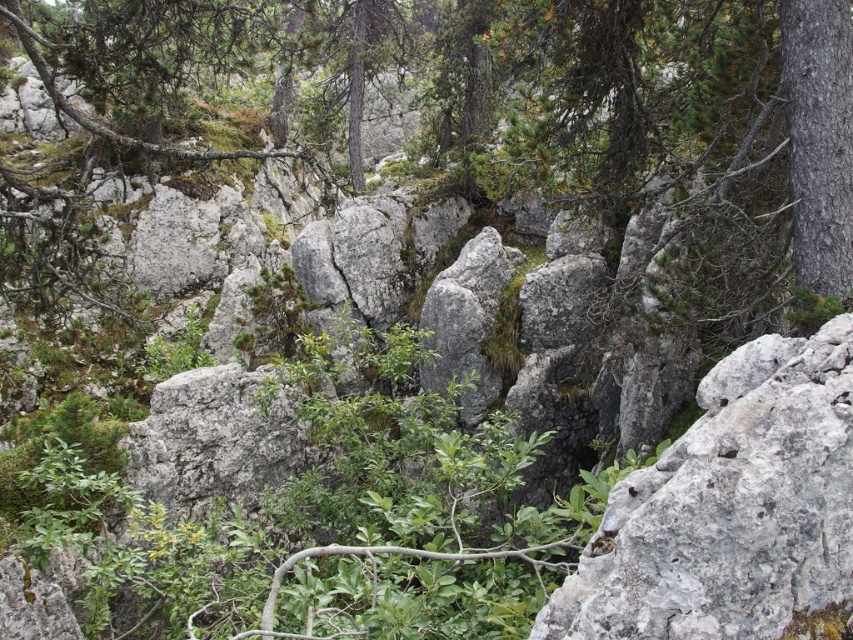
You are a hiker standing at the edge of a rocky path. You see the gray rough rock at center ahead of you. Can you reach it in one step if your average step length is 3 feet?

The gray rough rock at center is 7.50 feet away from viewer. Since your step length is 3 feet, you would need to take at least three steps to cover the distance. Therefore, you cannot reach it in one step.

You are a hiker trying to navigate through the rocky terrain. You see a gray rough rock at center and a smooth bark tree at right. Which one is taller?

The gray rough rock at center is shorter than the smooth bark tree at right, so the smooth bark tree at right is taller.

You are a hiker trying to navigate through the rocky terrain. You see a gray rough rock at center and a smooth bark tree at right. Which object is positioned closer to the left side of your view?

The gray rough rock at center is positioned to the left of the smooth bark tree at right, so it is closer to the left side of your view.